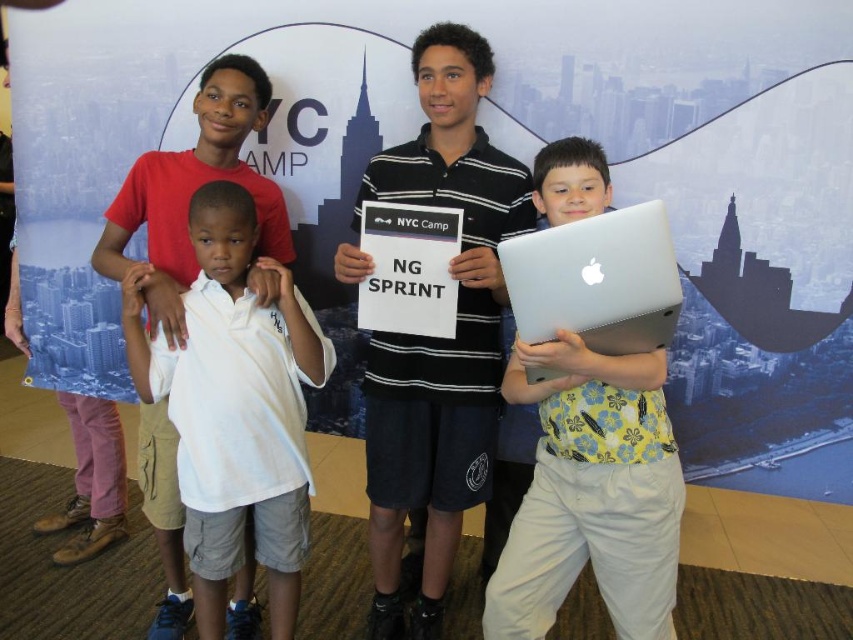
Question: From the image, what is the correct spatial relationship of silver metallic laptop at center in relation to silver metallic laptop at right?

Choices:
 (A) below
 (B) above

Answer: (A)

Question: Which is farther from the silver metallic laptop at right?

Choices:
 (A) silver metallic laptop at center
 (B) black striped polo shirt at center

Answer: (B)

Question: Is black striped polo shirt at center behind silver metallic laptop at right?

Choices:
 (A) yes
 (B) no

Answer: (A)

Question: Which point appears farthest from the camera in this image?

Choices:
 (A) (503, 196)
 (B) (639, 236)
 (C) (575, 541)
 (D) (194, 531)

Answer: (A)

Question: Does white cotton shirt at center have a greater width compared to silver metallic laptop at right?

Choices:
 (A) yes
 (B) no

Answer: (A)

Question: Which is farther from the silver metallic laptop at right?

Choices:
 (A) black striped polo shirt at center
 (B) white cotton shirt at center

Answer: (B)